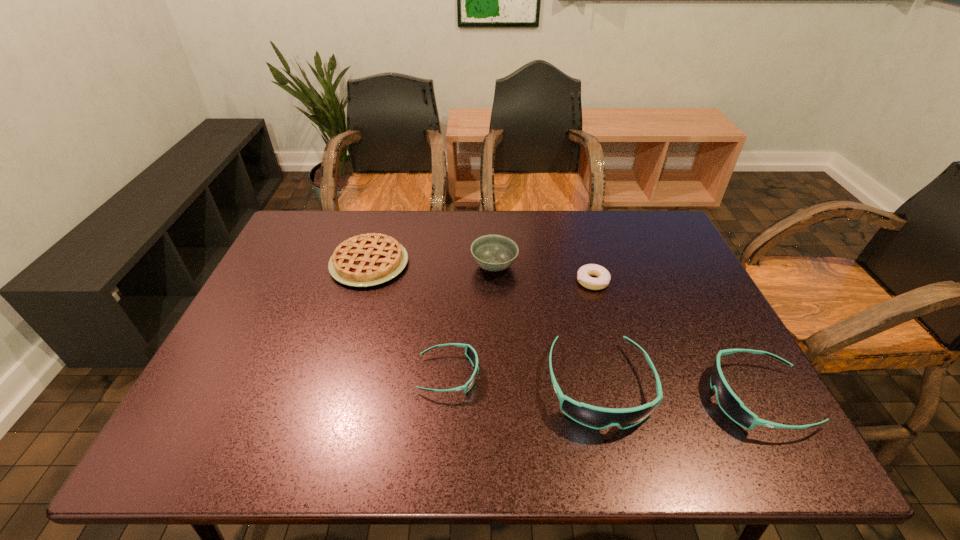
Image resolution: width=960 pixels, height=540 pixels. Find the location of `free space between the second sunglasses from left to right and the pie`. free space between the second sunglasses from left to right and the pie is located at coordinates (484, 325).

Identify the location of free spot between the second shortest sunglasses and the leftmost sunglasses. The image size is (960, 540). (603, 386).

Image resolution: width=960 pixels, height=540 pixels. In order to click on vacant space that's between the bowl and the rightmost object in this screenshot , I will do `click(626, 332)`.

Select which object is the third closest to the shortest object. Please provide its 2D coordinates. Your answer should be formatted as a tuple, i.e. [(x, y)], where the tuple contains the x and y coordinates of a point satisfying the conditions above.

[(731, 405)]

The height and width of the screenshot is (540, 960). I want to click on object that stands as the closest to the bowl, so click(583, 275).

Identify which sunglasses is the third nearest to the bowl. Please provide its 2D coordinates. Your answer should be formatted as a tuple, i.e. [(x, y)], where the tuple contains the x and y coordinates of a point satisfying the conditions above.

[(731, 405)]

Locate which sunglasses is the closest to the second shortest sunglasses. Please provide its 2D coordinates. Your answer should be formatted as a tuple, i.e. [(x, y)], where the tuple contains the x and y coordinates of a point satisfying the conditions above.

[(590, 416)]